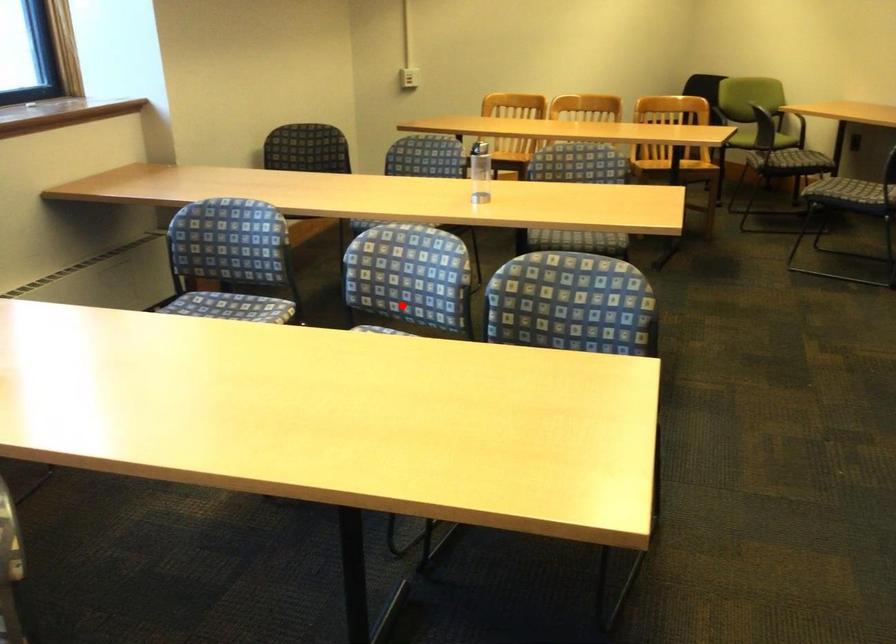
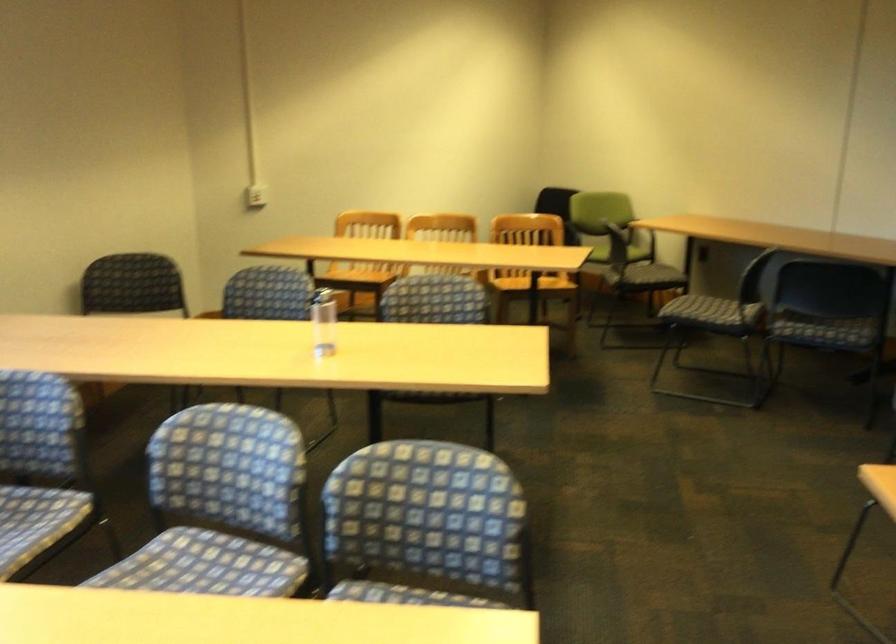
Question: I am providing you with two images of the same scene from different viewpoints. A red point is shown in image1. For the corresponding object point in image2, is it positioned nearer or farther from the camera?

Choices:
 (A) Nearer
 (B) Farther

Answer: (A)